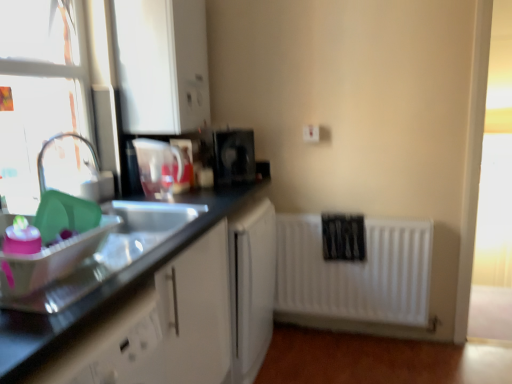
Question: From a real-world perspective, is black plastic coffee maker at center, which is the 1th appliance from right to left, positioned above or below white matte radiator at lower right?

Choices:
 (A) below
 (B) above

Answer: (B)

Question: Is point (229, 180) positioned closer to the camera than point (372, 299)?

Choices:
 (A) farther
 (B) closer

Answer: (B)

Question: Which is nearer to the white plastic electric outlet at upper center?

Choices:
 (A) white matte radiator at lower right
 (B) clear glass window at left
 (C) translucent plastic pitcher at upper center, which is the first appliance in front-to-back order
 (D) black plastic coffee maker at center, which is the 1th appliance from right to left
 (E) black granite sink at left

Answer: (D)

Question: Which object is positioned closest to the black granite sink at left?

Choices:
 (A) clear glass window at left
 (B) white plastic electric outlet at upper center
 (C) translucent plastic pitcher at upper center, acting as the 2th appliance starting from the right
 (D) white matte radiator at lower right
 (E) black plastic coffee maker at center, which appears as the 1th appliance when viewed from the back

Answer: (E)